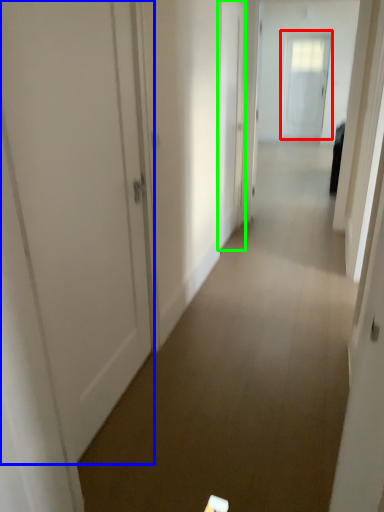
Question: Which object is the farthest from door (highlighted by a red box)? Choose among these: door (highlighted by a blue box) or door (highlighted by a green box).

Choices:
 (A) door
 (B) door

Answer: (A)